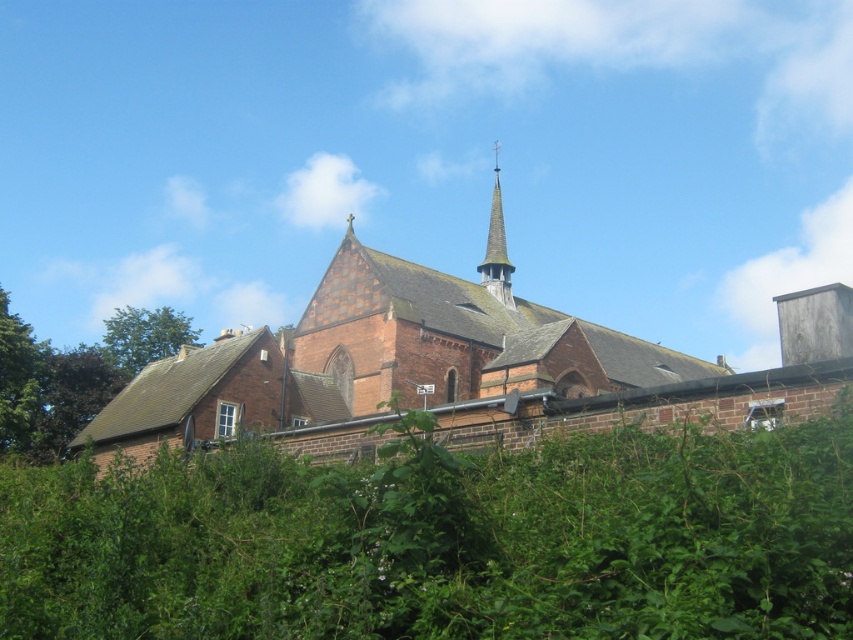
You are standing in front of the church and notice the green leafy tree at left and the smooth gray spire at upper center. From your perspective, which object is positioned higher in the image?

The smooth gray spire at upper center is positioned higher than the green leafy tree at left in the image.